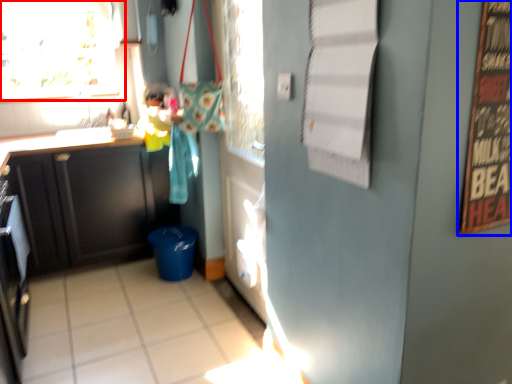
Question: Which point is further to the camera, window (highlighted by a red box) or bulletin board (highlighted by a blue box)?

Choices:
 (A) window
 (B) bulletin board

Answer: (A)